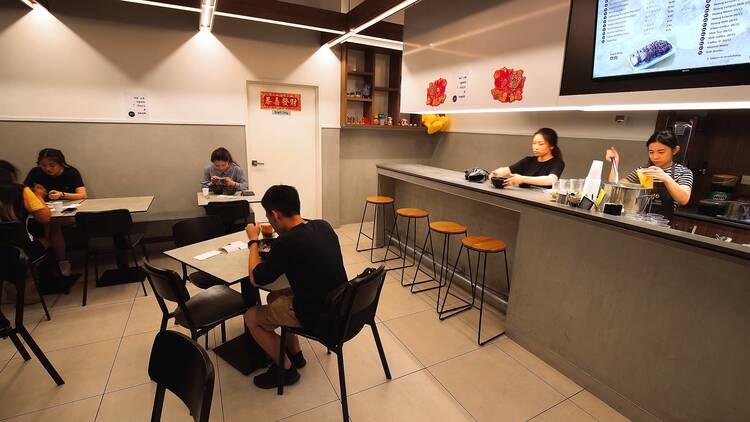
Identify the location of drinks in cups. (266, 227), (646, 174).